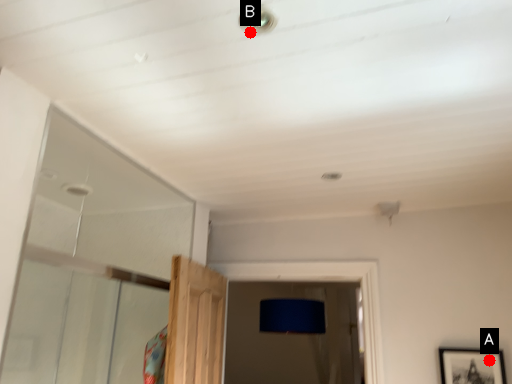
Question: Two points are circled on the image, labeled by A and B beside each circle. Which of the following is the closest to the observer?

Choices:
 (A) A is closer
 (B) B is closer

Answer: (B)